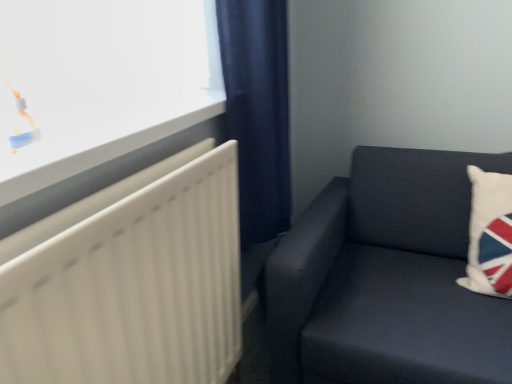
Identify the location of navy blue fabric curtain at center. (258, 111).

This screenshot has width=512, height=384. Identify the location of white matte radiator at left. (133, 288).

Identify the location of dark fabric couch at right. The width and height of the screenshot is (512, 384). (387, 279).

Describe the element at coordinates (102, 81) in the screenshot. I see `white glossy window at upper left` at that location.

Locate an element on the screen. The width and height of the screenshot is (512, 384). navy blue fabric curtain at center is located at coordinates (258, 111).

Is dark fabric couch at right at the left side of white fabric pillow at right?

Correct, you'll find dark fabric couch at right to the left of white fabric pillow at right.

Which of these two, dark fabric couch at right or white fabric pillow at right, stands shorter?

With less height is white fabric pillow at right.

The width and height of the screenshot is (512, 384). I want to click on studio couch that appears on the left of white fabric pillow at right, so click(387, 279).

From the picture: From the image's perspective, is white glossy window at upper left located beneath dark fabric couch at right?

Incorrect, from the image's perspective, white glossy window at upper left is higher than dark fabric couch at right.

Is white glossy window at upper left to the right of dark fabric couch at right from the viewer's perspective?

No, white glossy window at upper left is not to the right of dark fabric couch at right.

Would you say white glossy window at upper left is a long distance from dark fabric couch at right?

No, white glossy window at upper left is in close proximity to dark fabric couch at right.

Considering the positions of objects white glossy window at upper left and white matte radiator at left in the image provided, who is more to the left, white glossy window at upper left or white matte radiator at left?

white glossy window at upper left.

Is white glossy window at upper left further to the viewer compared to white matte radiator at left?

Yes, white glossy window at upper left is further from the camera.

How far apart are white glossy window at upper left and white matte radiator at left?

They are 10.39 inches apart.

Is white glossy window at upper left far from white matte radiator at left?

No.

Where is `pillow that is under the white glossy window at upper left (from a real-world perspective)`? The width and height of the screenshot is (512, 384). pillow that is under the white glossy window at upper left (from a real-world perspective) is located at coordinates coord(489,234).

From a real-world perspective, does white fabric pillow at right stand above white glossy window at upper left?

Incorrect, from a real-world perspective, white fabric pillow at right is lower than white glossy window at upper left.

Who is bigger, white fabric pillow at right or white glossy window at upper left?

white fabric pillow at right.

Does white fabric pillow at right have a larger size compared to dark fabric couch at right?

No.

Which is in front, point (490, 219) or point (309, 291)?

Positioned in front is point (309, 291).

Is white fabric pillow at right taller or shorter than dark fabric couch at right?

white fabric pillow at right is shorter than dark fabric couch at right.

This screenshot has width=512, height=384. What are the coordinates of `pillow behind the dark fabric couch at right` in the screenshot? It's located at tap(489, 234).

Which of these two, navy blue fabric curtain at center or dark fabric couch at right, is smaller?

navy blue fabric curtain at center is smaller.

From the image's perspective, would you say navy blue fabric curtain at center is positioned over dark fabric couch at right?

Yes, from the image's perspective, navy blue fabric curtain at center is over dark fabric couch at right.

From a real-world perspective, is navy blue fabric curtain at center physically above dark fabric couch at right?

Correct, in the physical world, navy blue fabric curtain at center is higher than dark fabric couch at right.

From the image's perspective, is white glossy window at upper left located beneath white fabric pillow at right?

No.

Considering their positions, is white glossy window at upper left located in front of or behind white fabric pillow at right?

Visually, white glossy window at upper left is located in front of white fabric pillow at right.

Does point (76, 52) come closer to viewer compared to point (503, 237)?

Yes, it is in front of point (503, 237).

From a real-world perspective, is white glossy window at upper left on top of white fabric pillow at right?

Correct, in the physical world, white glossy window at upper left is higher than white fabric pillow at right.

Locate an element on the screen. This screenshot has height=384, width=512. pillow that is behind the dark fabric couch at right is located at coordinates (489, 234).

What are the coordinates of `studio couch below the white glossy window at upper left (from the image's perspective)` in the screenshot? It's located at (387, 279).

From the image, which object appears to be farther from white matte radiator at left, white glossy window at upper left or navy blue fabric curtain at center?

Based on the image, navy blue fabric curtain at center appears to be further to white matte radiator at left.

When comparing their distances from white matte radiator at left, does white glossy window at upper left or dark fabric couch at right seem further?

dark fabric couch at right is further to white matte radiator at left.

Considering their positions, is white fabric pillow at right positioned closer to white glossy window at upper left than dark fabric couch at right?

dark fabric couch at right.

Based on their spatial positions, is white glossy window at upper left or white matte radiator at left closer to navy blue fabric curtain at center?

white glossy window at upper left lies closer to navy blue fabric curtain at center than the other object.

From the image, which object appears to be nearer to white fabric pillow at right, dark fabric couch at right or white glossy window at upper left?

Among the two, dark fabric couch at right is located nearer to white fabric pillow at right.

From the image, which object appears to be nearer to navy blue fabric curtain at center, white glossy window at upper left or dark fabric couch at right?

white glossy window at upper left lies closer to navy blue fabric curtain at center than the other object.

From the image, which object appears to be nearer to white glossy window at upper left, white fabric pillow at right or white matte radiator at left?

Among the two, white matte radiator at left is located nearer to white glossy window at upper left.

Which object lies further to the anchor point dark fabric couch at right, white glossy window at upper left or white matte radiator at left?

The object further to dark fabric couch at right is white glossy window at upper left.

What are the coordinates of `studio couch between navy blue fabric curtain at center and white fabric pillow at right in the horizontal direction` in the screenshot? It's located at (387, 279).

Where is `radiator situated between white glossy window at upper left and dark fabric couch at right from left to right`? This screenshot has width=512, height=384. radiator situated between white glossy window at upper left and dark fabric couch at right from left to right is located at coordinates tap(133, 288).

This screenshot has height=384, width=512. Identify the location of curtain between white matte radiator at left and white fabric pillow at right in the horizontal direction. (258, 111).

At what (x,y) coordinates should I click in order to perform the action: click on window between navy blue fabric curtain at center and white matte radiator at left vertically. Please return your answer as a coordinate pair (x, y). Image resolution: width=512 pixels, height=384 pixels. Looking at the image, I should click on (102, 81).